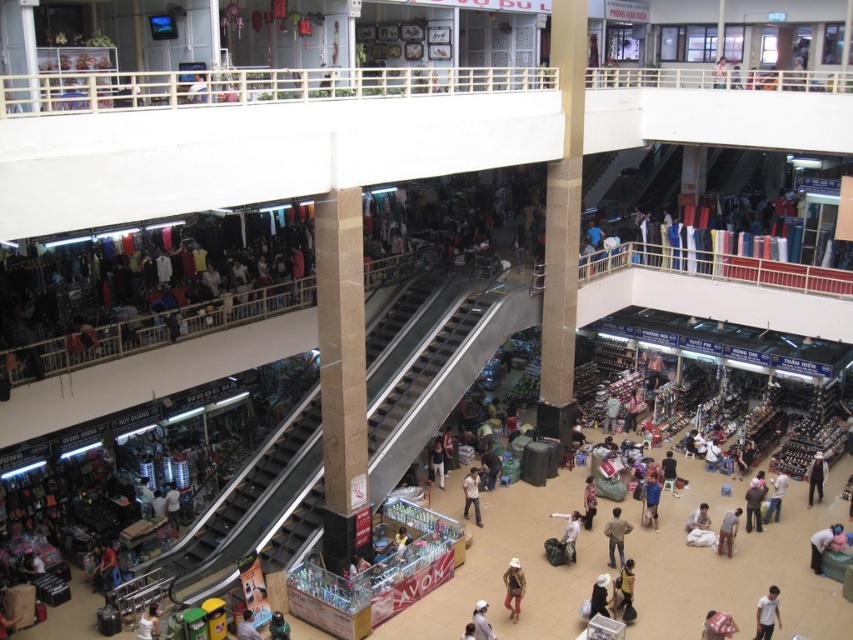
Can you confirm if metallic silver escalator at center is taller than white matte shirt at center?

Yes, metallic silver escalator at center is taller than white matte shirt at center.

Is point (245, 500) closer to camera compared to point (810, 464)?

Yes, it is in front of point (810, 464).

Which is in front, point (315, 509) or point (822, 486)?

Positioned in front is point (315, 509).

What are the coordinates of `metallic silver escalator at center` in the screenshot? It's located at (262, 509).

Between white matte shirt at lower right and yellow fabric bag at center, which one appears on the right side from the viewer's perspective?

white matte shirt at lower right

Locate an element on the screen. white matte shirt at lower right is located at coordinates (767, 612).

Which is more to the left, light brown fabric shirt at lower right or white matte shirt at lower right?

white matte shirt at lower right is more to the left.

Which is above, light brown fabric shirt at lower right or white matte shirt at lower right?

light brown fabric shirt at lower right is above.

What do you see at coordinates (825, 545) in the screenshot? The height and width of the screenshot is (640, 853). I see `light brown fabric shirt at lower right` at bounding box center [825, 545].

At what (x,y) coordinates should I click in order to perform the action: click on light brown fabric shirt at lower right. Please return your answer as a coordinate pair (x, y). The image size is (853, 640). Looking at the image, I should click on (825, 545).